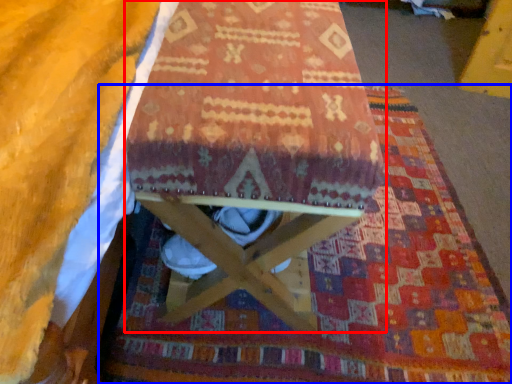
Question: Which object is further to the camera taking this photo, furniture (highlighted by a red box) or mat (highlighted by a blue box)?

Choices:
 (A) furniture
 (B) mat

Answer: (B)